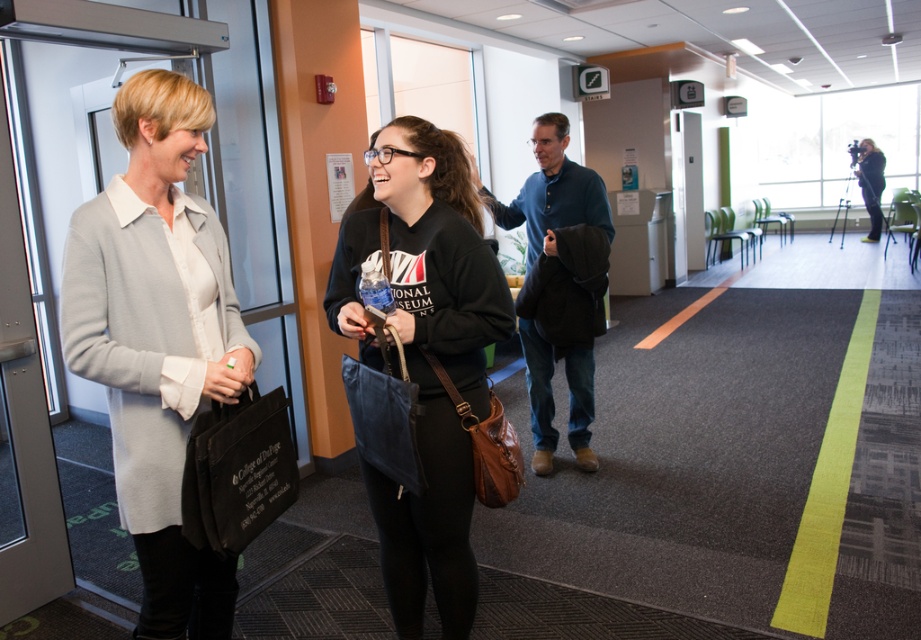
Question: Among these objects, which one is nearest to the camera?

Choices:
 (A) light gray sweater at left
 (B) blue cotton shirt at center

Answer: (A)

Question: Can you confirm if light gray sweater at left is positioned to the left of black matte sweatshirt at center?

Choices:
 (A) yes
 (B) no

Answer: (A)

Question: Which object appears farthest from the camera in this image?

Choices:
 (A) light gray sweater at left
 (B) black matte sweatshirt at center
 (C) blue cotton shirt at center

Answer: (C)

Question: Which point is closer to the camera?

Choices:
 (A) (578, 412)
 (B) (399, 148)
 (C) (187, 218)

Answer: (C)

Question: Is light gray sweater at left bigger than black matte sweatshirt at center?

Choices:
 (A) yes
 (B) no

Answer: (B)

Question: Is light gray sweater at left behind black matte sweatshirt at center?

Choices:
 (A) yes
 (B) no

Answer: (B)